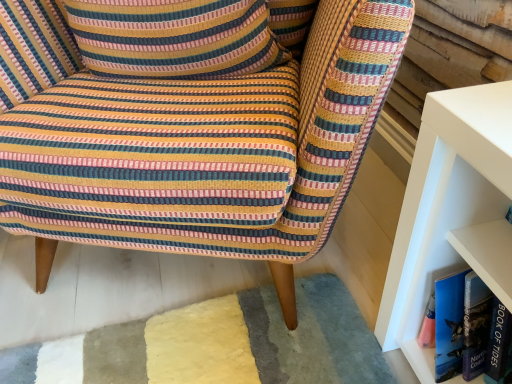
Question: From the image's perspective, does striped fabric chair at center appear lower than blue hardcover book at right?

Choices:
 (A) no
 (B) yes

Answer: (A)

Question: Is striped fabric chair at center positioned before blue hardcover book at right?

Choices:
 (A) yes
 (B) no

Answer: (A)

Question: Can you confirm if striped fabric chair at center is positioned to the right of blue hardcover book at right?

Choices:
 (A) yes
 (B) no

Answer: (B)

Question: Is striped fabric chair at center directly adjacent to blue hardcover book at right?

Choices:
 (A) no
 (B) yes

Answer: (A)

Question: From a real-world perspective, is striped fabric chair at center on top of blue hardcover book at right?

Choices:
 (A) yes
 (B) no

Answer: (A)

Question: From the image's perspective, is blue hardcover book at right positioned above or below striped fabric chair at center?

Choices:
 (A) below
 (B) above

Answer: (A)

Question: Is blue hardcover book at right wider or thinner than striped fabric chair at center?

Choices:
 (A) wide
 (B) thin

Answer: (B)

Question: In the image, is blue hardcover book at right on the left side or the right side of striped fabric chair at center?

Choices:
 (A) right
 (B) left

Answer: (A)

Question: In terms of size, does blue hardcover book at right appear bigger or smaller than striped fabric chair at center?

Choices:
 (A) big
 (B) small

Answer: (B)

Question: In terms of width, does striped fabric pillow at upper left look wider or thinner when compared to striped fabric chair at center?

Choices:
 (A) wide
 (B) thin

Answer: (B)

Question: Looking at the image, does striped fabric pillow at upper left seem bigger or smaller compared to striped fabric chair at center?

Choices:
 (A) small
 (B) big

Answer: (A)

Question: Is striped fabric pillow at upper left inside or outside of striped fabric chair at center?

Choices:
 (A) inside
 (B) outside

Answer: (A)

Question: Is point (134, 44) positioned closer to the camera than point (59, 200)?

Choices:
 (A) farther
 (B) closer

Answer: (A)

Question: In the image, is blue hardcover book at right on the left side or the right side of striped fabric pillow at upper left?

Choices:
 (A) right
 (B) left

Answer: (A)

Question: From a real-world perspective, relative to striped fabric pillow at upper left, is blue hardcover book at right vertically above or below?

Choices:
 (A) below
 (B) above

Answer: (A)